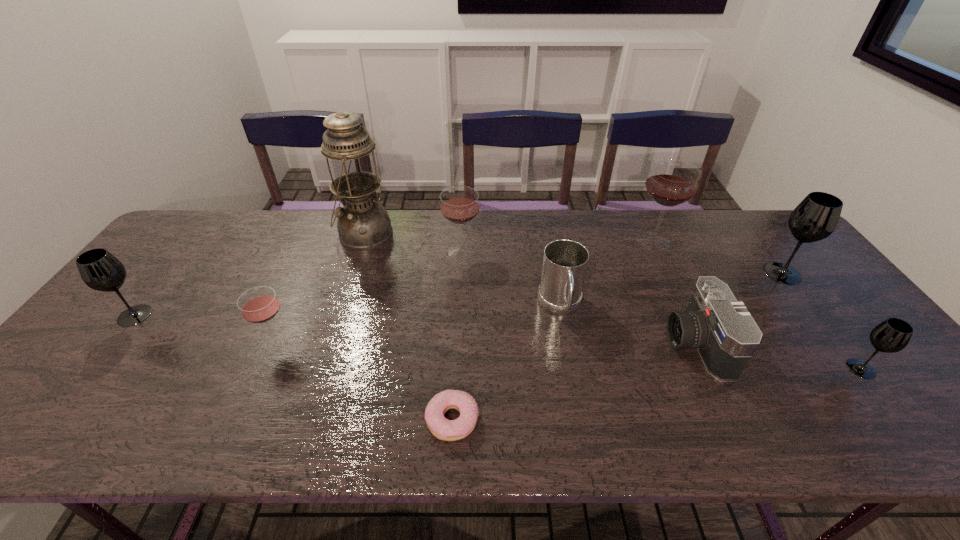
The height and width of the screenshot is (540, 960). I want to click on vacant region located 0.340m on the left of the second red wineglass from right to left, so click(x=334, y=252).

At what (x,y) coordinates should I click in order to perform the action: click on free space located on the back of the leftmost gray wineglass. Please return your answer as a coordinate pair (x, y). This screenshot has width=960, height=540. Looking at the image, I should click on (154, 292).

This screenshot has width=960, height=540. Find the location of `free region located on the side of the sixth object from left to right with the handle`. free region located on the side of the sixth object from left to right with the handle is located at coordinates (586, 444).

Where is `free space located 0.260m on the back of the second nearest wineglass`? free space located 0.260m on the back of the second nearest wineglass is located at coordinates [310, 264].

Find the location of `free point located on the back of the nearest wineglass`. free point located on the back of the nearest wineglass is located at coordinates (822, 319).

Where is `vacant space situated 0.150m on the front-facing side of the camera`? Image resolution: width=960 pixels, height=540 pixels. vacant space situated 0.150m on the front-facing side of the camera is located at coordinates (608, 343).

At what (x,y) coordinates should I click in order to perform the action: click on free location located on the front-facing side of the camera. Please return your answer as a coordinate pair (x, y). Looking at the image, I should click on pos(588,343).

Identify the location of vacant space situated 0.400m on the front-facing side of the camera. This screenshot has width=960, height=540. (509, 343).

The image size is (960, 540). What are the coordinates of `free region located on the left of the pink doughnut` in the screenshot? It's located at (366, 420).

Where is `oil lamp situated at the far edge`? The width and height of the screenshot is (960, 540). oil lamp situated at the far edge is located at coordinates (363, 224).